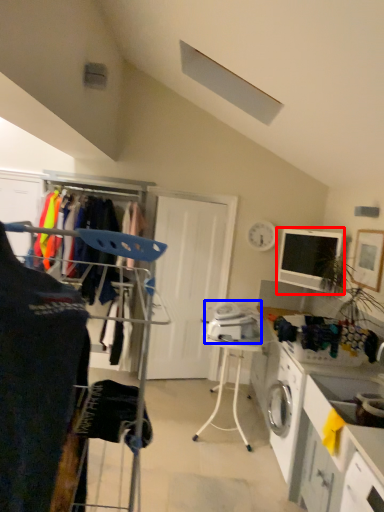
Question: Which object is further to the camera taking this photo, computer monitor (highlighted by a red box) or appliance (highlighted by a blue box)?

Choices:
 (A) computer monitor
 (B) appliance

Answer: (A)